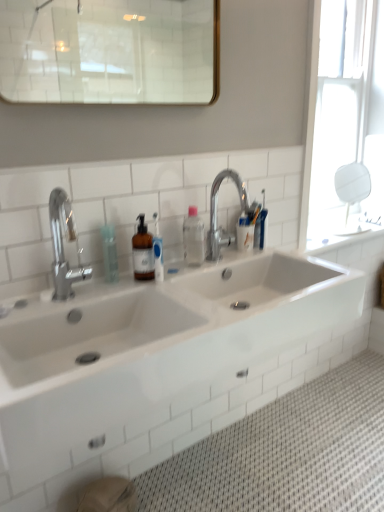
Question: From the image's perspective, is silver metallic faucet at upper center, arranged as the second tap when viewed from the left, located above transparent plastic bottle at center?

Choices:
 (A) yes
 (B) no

Answer: (A)

Question: Is silver metallic faucet at upper center, which ranks as the 1th tap in back-to-front order, positioned far away from transparent plastic bottle at center?

Choices:
 (A) no
 (B) yes

Answer: (A)

Question: From a real-world perspective, does silver metallic faucet at upper center, arranged as the second tap when viewed from the left, stand above transparent plastic bottle at center?

Choices:
 (A) no
 (B) yes

Answer: (B)

Question: Is silver metallic faucet at upper center, which is counted as the first tap, starting from the right, shorter than transparent plastic bottle at center?

Choices:
 (A) yes
 (B) no

Answer: (B)

Question: Is silver metallic faucet at upper center, which is counted as the first tap, starting from the right, located outside transparent plastic bottle at center?

Choices:
 (A) yes
 (B) no

Answer: (A)

Question: Considering the relative positions of transparent glass mirror at upper right and white glossy sink at center in the image provided, is transparent glass mirror at upper right to the left or to the right of white glossy sink at center?

Choices:
 (A) left
 (B) right

Answer: (B)

Question: From a real-world perspective, is transparent glass mirror at upper right above or below white glossy sink at center?

Choices:
 (A) below
 (B) above

Answer: (B)

Question: Looking at the image, does transparent glass mirror at upper right seem bigger or smaller compared to white glossy sink at center?

Choices:
 (A) small
 (B) big

Answer: (A)

Question: From the image's perspective, relative to white glossy sink at center, is transparent glass mirror at upper right above or below?

Choices:
 (A) above
 (B) below

Answer: (A)

Question: From the image's perspective, is polished chrome faucet at left, which is the 2th tap in back-to-front order, above or below transparent glass mirror at upper right?

Choices:
 (A) below
 (B) above

Answer: (A)

Question: Is polished chrome faucet at left, which is the 2th tap in back-to-front order, in front of or behind transparent glass mirror at upper right in the image?

Choices:
 (A) front
 (B) behind

Answer: (A)

Question: Is polished chrome faucet at left, which appears as the 2th tap when viewed from the right, bigger or smaller than transparent glass mirror at upper right?

Choices:
 (A) big
 (B) small

Answer: (B)

Question: Is polished chrome faucet at left, which is the 2th tap in back-to-front order, taller or shorter than transparent glass mirror at upper right?

Choices:
 (A) tall
 (B) short

Answer: (B)

Question: In terms of height, does silver metallic faucet at upper center, which ranks as the 1th tap in back-to-front order, look taller or shorter compared to polished chrome faucet at left, placed as the first tap when sorted from front to back?

Choices:
 (A) short
 (B) tall

Answer: (A)

Question: Is point (210, 200) closer or farther from the camera than point (72, 294)?

Choices:
 (A) closer
 (B) farther

Answer: (B)